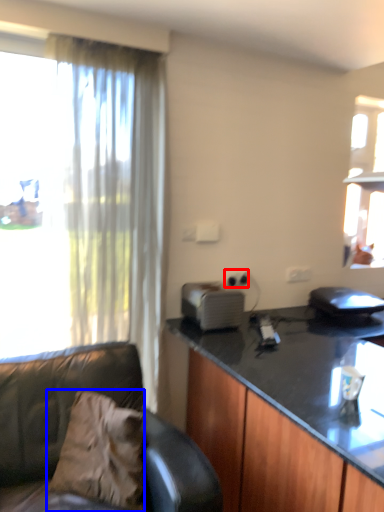
Question: Which object appears closest to the camera in this image, power outlet (highlighted by a red box) or pillow (highlighted by a blue box)?

Choices:
 (A) power outlet
 (B) pillow

Answer: (B)